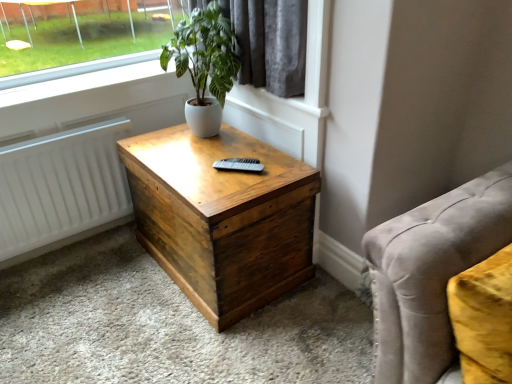
What are the coordinates of `free space above white matte radiator at left (from a real-world perspective)` in the screenshot? It's located at coord(62,137).